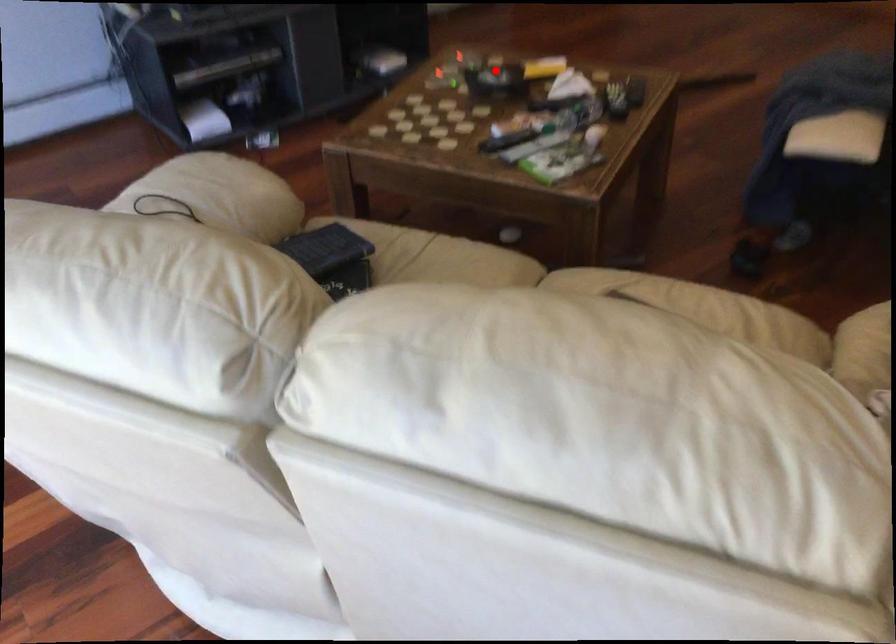
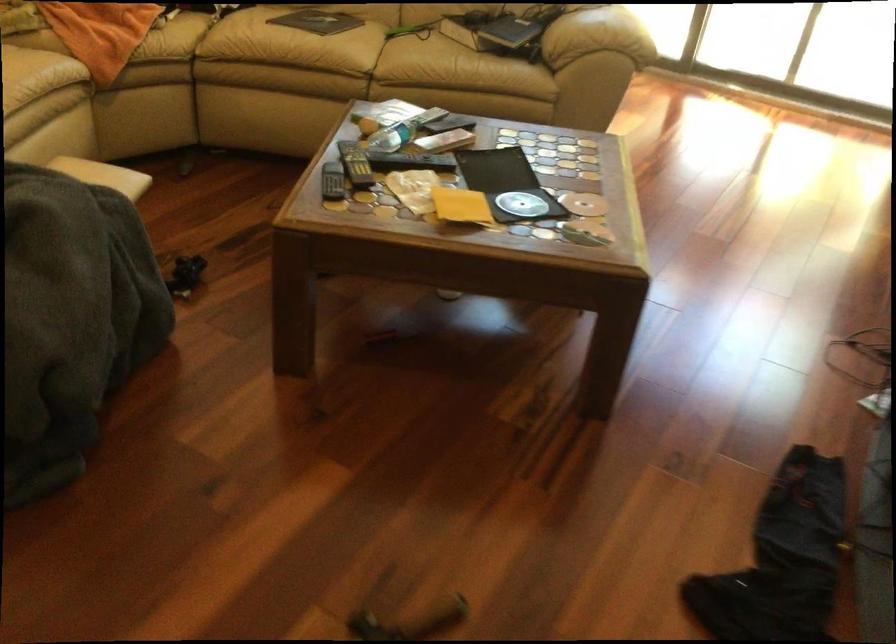
Find the pixel in the second image that matches the highlighted location in the first image.

(521, 204)